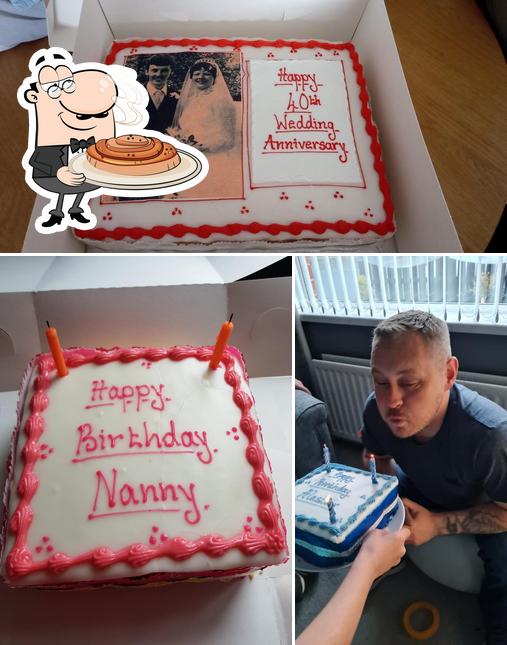
At what (x,y) coordinates should I click in order to perform the action: click on birthday candle. Please return your answer as a coordinate pair (x, y). This screenshot has width=507, height=645. Looking at the image, I should click on (60, 359), (216, 350), (329, 462), (332, 517), (373, 468).